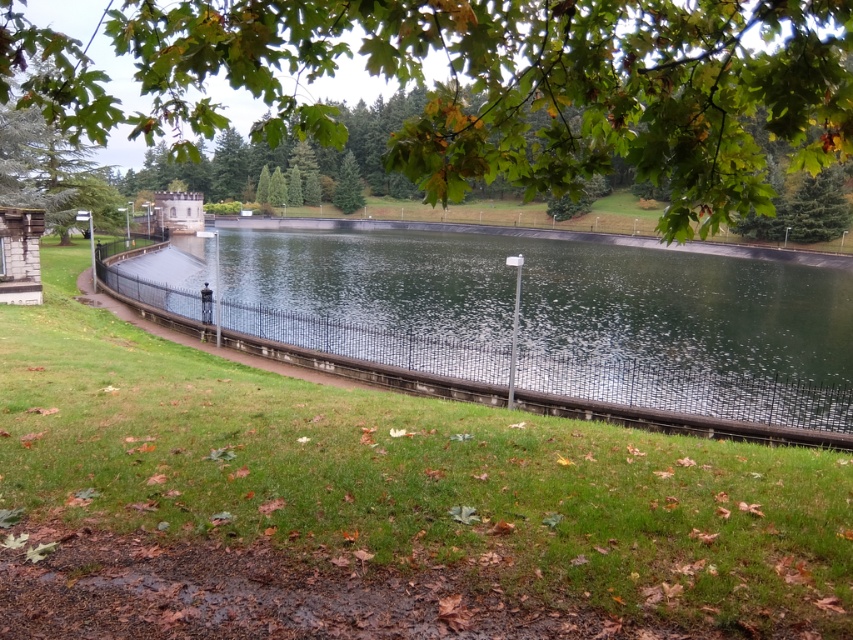
Question: Which point is farther to the camera?

Choices:
 (A) green leafy tree at upper center
 (B) clear glass water at center
 (C) green grass at center

Answer: (B)

Question: Does green grass at center appear on the right side of green matte tree at center?

Choices:
 (A) yes
 (B) no

Answer: (A)

Question: Which point appears closest to the camera in this image?

Choices:
 (A) (97, 604)
 (B) (779, 124)
 (C) (347, 157)

Answer: (A)

Question: Which object is closer to the camera taking this photo?

Choices:
 (A) clear glass water at center
 (B) green grass at center

Answer: (B)

Question: Is green leafy tree at upper center positioned behind clear glass water at center?

Choices:
 (A) no
 (B) yes

Answer: (A)

Question: Can you confirm if clear glass water at center is positioned to the right of green matte tree at center?

Choices:
 (A) no
 (B) yes

Answer: (B)